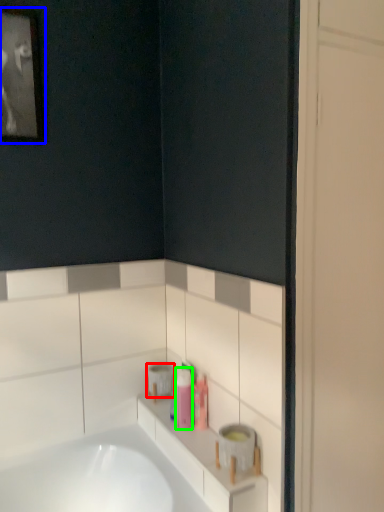
Question: Estimate the real-world distances between objects in this image. Which object is farther from toilet paper (highlighted by a red box), picture frame (highlighted by a blue box) or toiletry (highlighted by a green box)?

Choices:
 (A) picture frame
 (B) toiletry

Answer: (A)